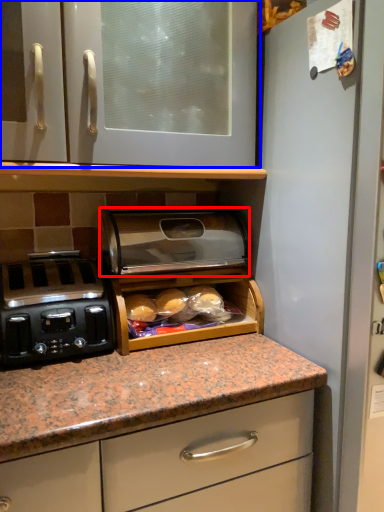
Question: Which object is further to the camera taking this photo, appliance (highlighted by a red box) or cabinetry (highlighted by a blue box)?

Choices:
 (A) appliance
 (B) cabinetry

Answer: (A)